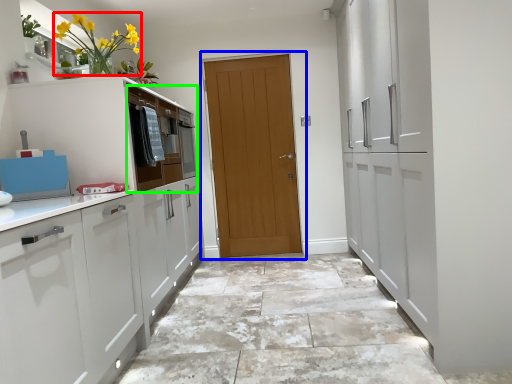
Question: Considering the real-world distances, which object is farthest from floral arrangement (highlighted by a red box)? door (highlighted by a blue box) or drawer (highlighted by a green box)?

Choices:
 (A) door
 (B) drawer

Answer: (A)